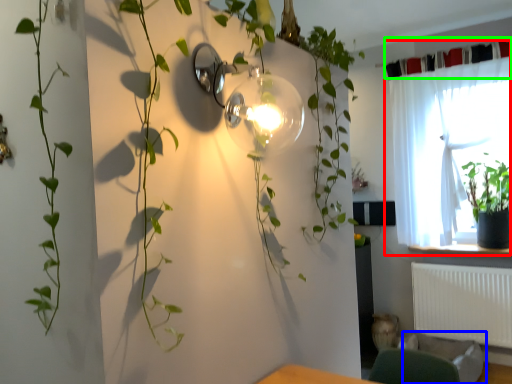
Question: Based on their relative distances, which object is nearer to curtain (highlighted by a red box)? Choose from swivel chair (highlighted by a blue box) and curtain (highlighted by a green box).

Choices:
 (A) swivel chair
 (B) curtain

Answer: (B)